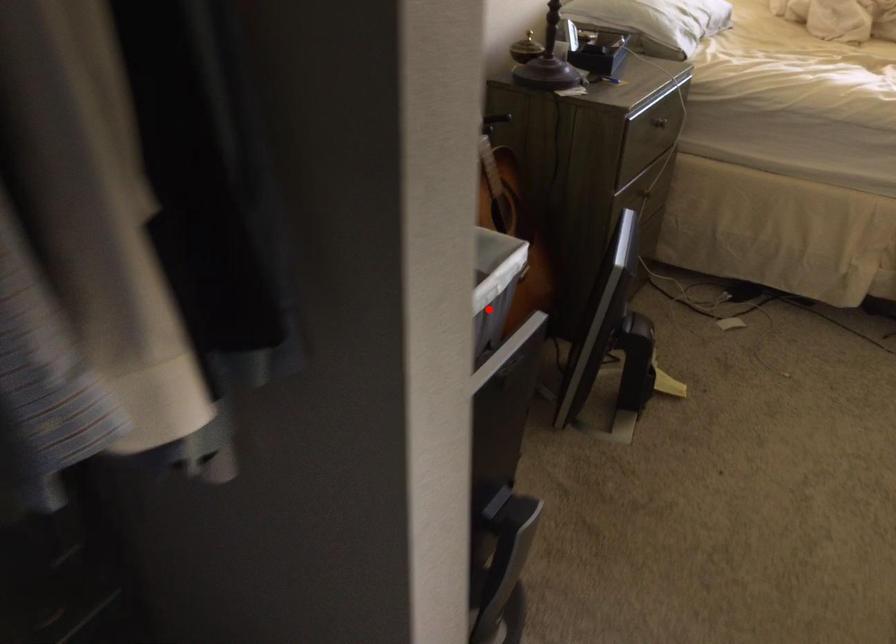
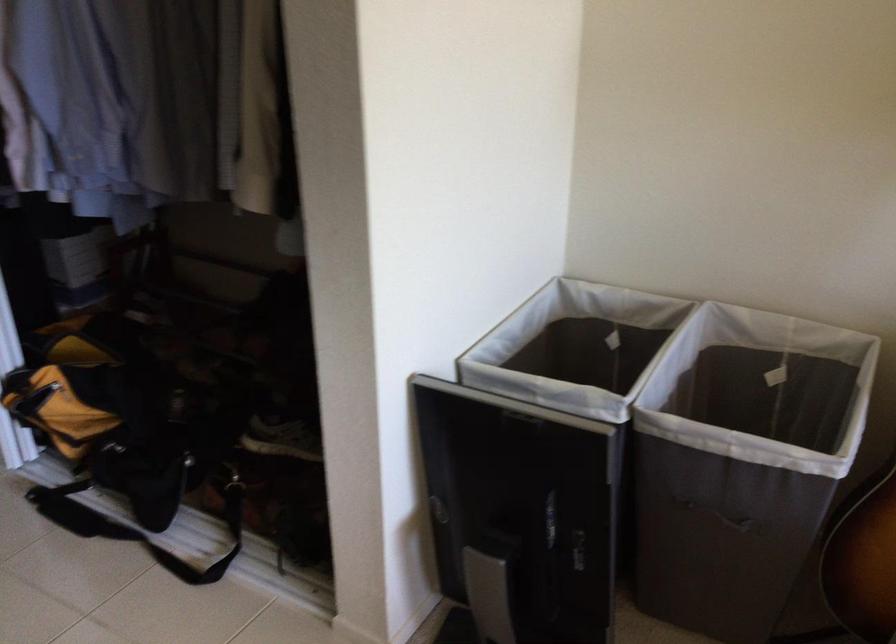
Find the pixel in the second image that matches the highlighted location in the first image.

(742, 462)